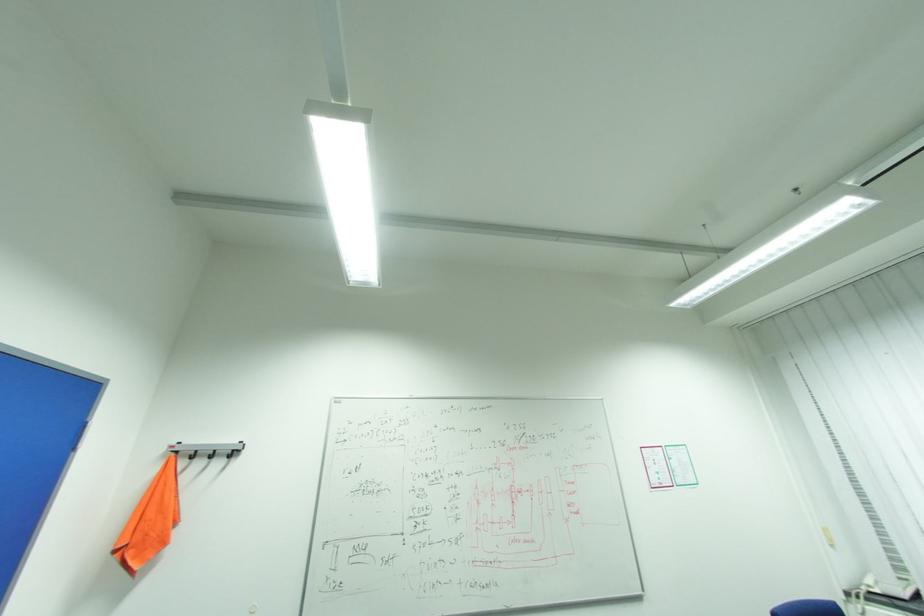
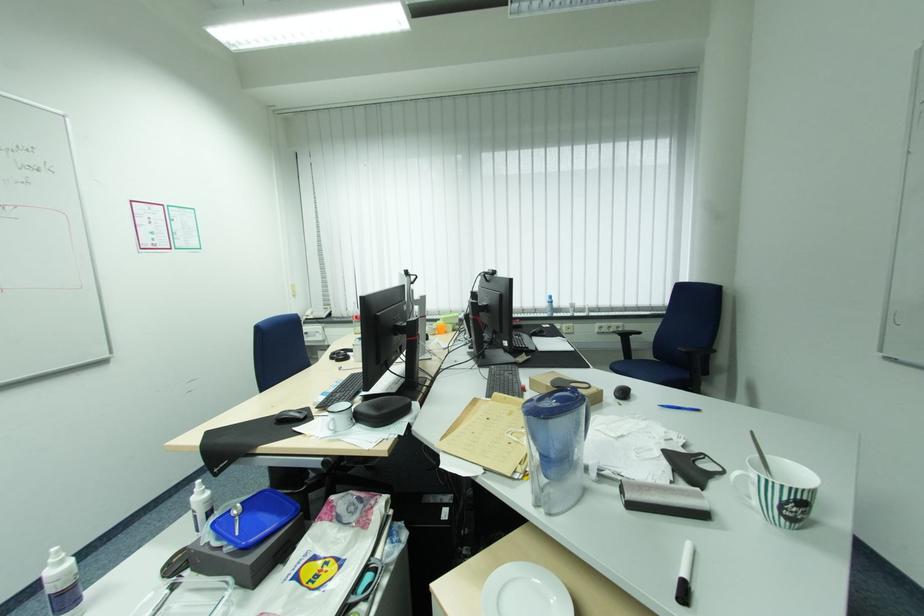
Question: The images are taken continuously from a first-person perspective. In which direction is your viewpoint rotating?

Choices:
 (A) Left
 (B) Right
 (C) Up
 (D) Down

Answer: (B)